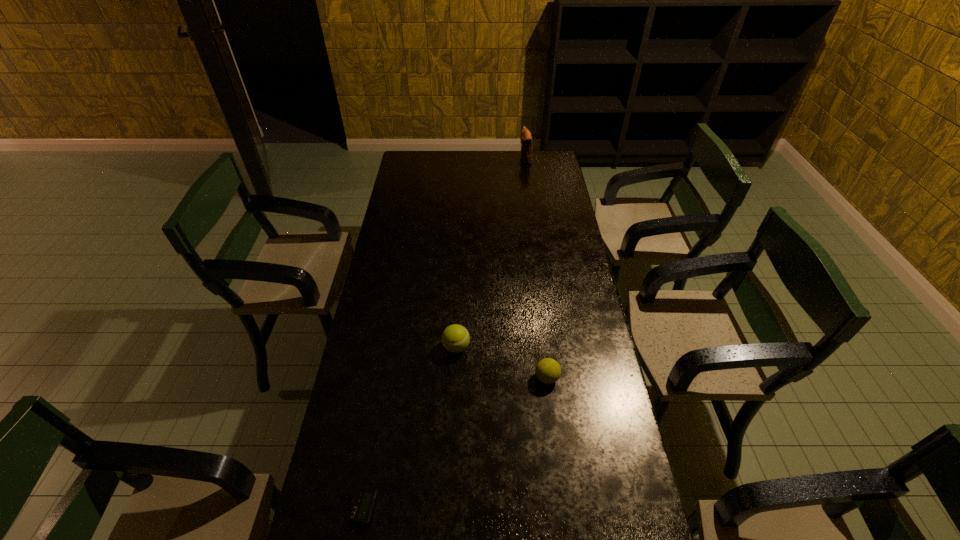
Locate an element on the screen. Image resolution: width=960 pixels, height=540 pixels. the farthest object is located at coordinates (526, 139).

Locate an element on the screen. the tallest object is located at coordinates (526, 139).

Locate an element on the screen. The width and height of the screenshot is (960, 540). the third shortest object is located at coordinates (455, 338).

The image size is (960, 540). What are the coordinates of `the third object from right to left` in the screenshot? It's located at (455, 338).

Identify the location of the nearer tennis ball. This screenshot has height=540, width=960. (548, 371).

Locate an element on the screen. The height and width of the screenshot is (540, 960). the third tallest object is located at coordinates (548, 371).

Where is `the shortest object`? The image size is (960, 540). the shortest object is located at coordinates (363, 502).

Find the location of a particular element. Image resolution: width=960 pixels, height=540 pixels. the nearest object is located at coordinates (363, 502).

This screenshot has height=540, width=960. What are the coordinates of `free location located 0.110m on the open side of the tallest object` in the screenshot? It's located at (499, 159).

Image resolution: width=960 pixels, height=540 pixels. In order to click on free location located 0.330m on the open side of the tallest object in this screenshot , I will do `click(459, 159)`.